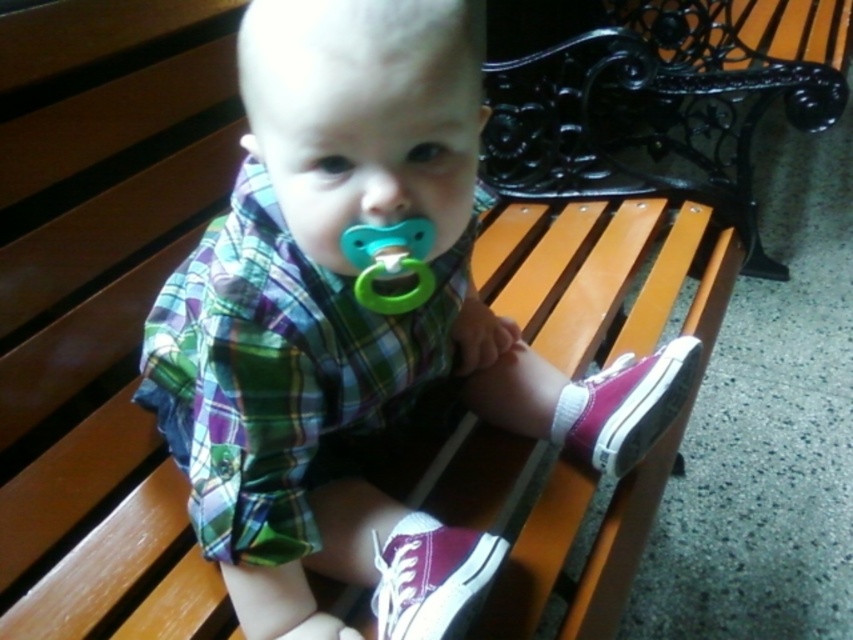
Does point (363, 76) lie behind point (346, 237)?

No, (363, 76) is in front of (346, 237).

Can you confirm if plaid fabric shirt at center is positioned to the left of green rubber pacifier at center?

Incorrect, plaid fabric shirt at center is not on the left side of green rubber pacifier at center.

Is point (347, 216) farther from camera compared to point (405, 250)?

No, it is not.

You are a GUI agent. You are given a task and a screenshot of the screen. Output one action in this format:
    pyautogui.click(x=<x>, y=<y>)
    Task: Click on the plaid fabric shirt at center
    Image resolution: width=853 pixels, height=640 pixels.
    Given the screenshot: What is the action you would take?
    pyautogui.click(x=357, y=326)